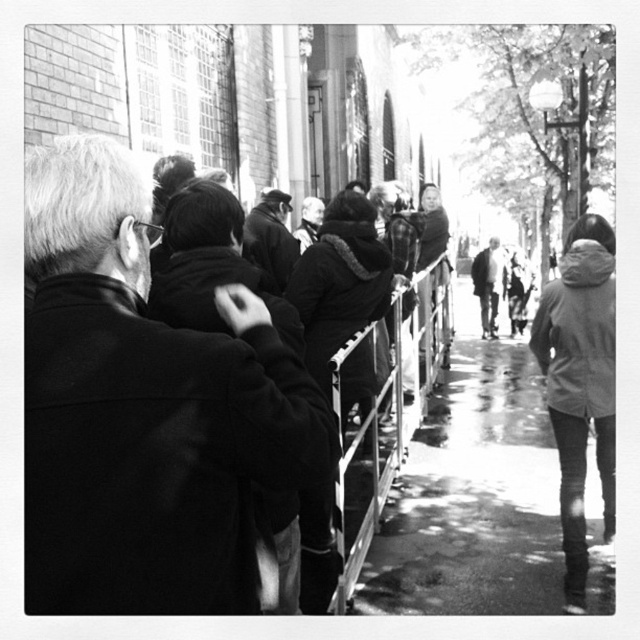
Who is more forward, (584, 336) or (486, 321)?

Point (584, 336) is more forward.

Is the position of denim jacket at lower right more distant than that of dark gray coat at center?

That is False.

Who is more forward, [568,600] or [490,292]?

Point [568,600]

Locate an element on the screen. denim jacket at lower right is located at coordinates (580, 384).

Does black wool coat at center have a greater height compared to wet asphalt sidewalk at center?

Correct, black wool coat at center is much taller as wet asphalt sidewalk at center.

Is point (120, 428) closer to viewer compared to point (540, 516)?

Yes.

What are the coordinates of `black wool coat at center` in the screenshot? It's located at (144, 410).

Does black wool coat at center lie behind denim jacket at lower right?

No, it is in front of denim jacket at lower right.

Find the location of a particular element. The image size is (640, 640). black wool coat at center is located at coordinates (144, 410).